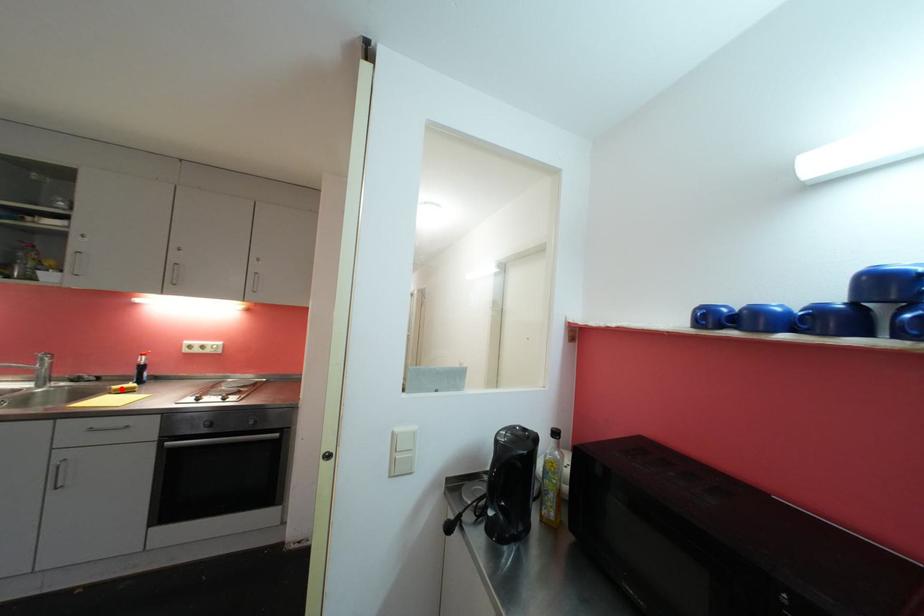
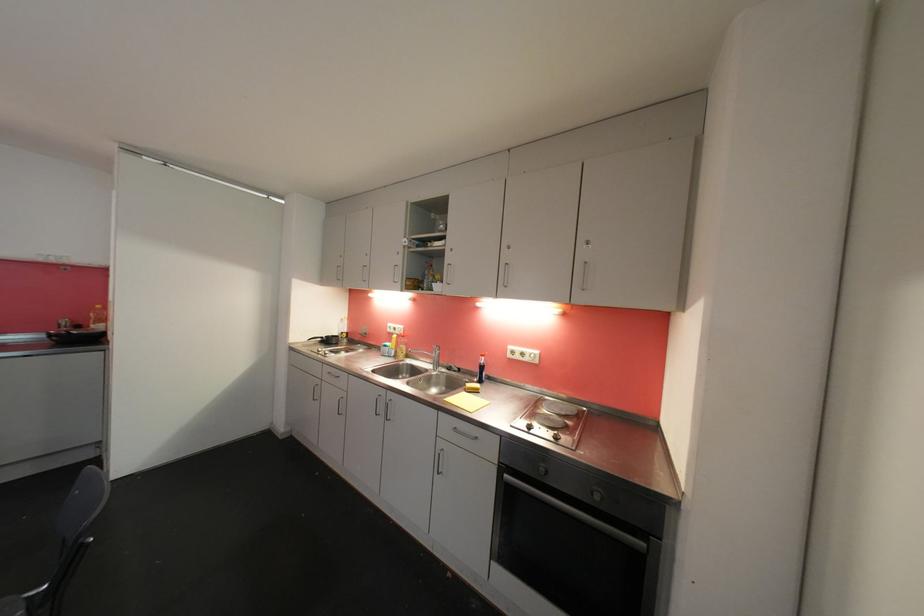
The point at the highlighted location is marked in the first image. Where is the corresponding point in the second image?

(473, 387)